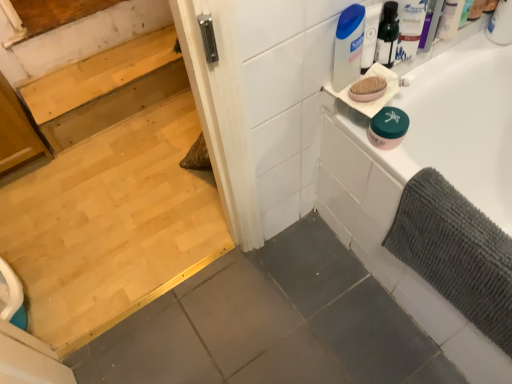
Question: From the image's perspective, does pink matte oval soap at upper right appear lower than green matte jar at upper right?

Choices:
 (A) yes
 (B) no

Answer: (B)

Question: Are pink matte oval soap at upper right and green matte jar at upper right making contact?

Choices:
 (A) no
 (B) yes

Answer: (B)

Question: Considering the relative sizes of pink matte oval soap at upper right and green matte jar at upper right in the image provided, is pink matte oval soap at upper right bigger than green matte jar at upper right?

Choices:
 (A) no
 (B) yes

Answer: (A)

Question: Are pink matte oval soap at upper right and green matte jar at upper right located far from each other?

Choices:
 (A) yes
 (B) no

Answer: (B)

Question: Is pink matte oval soap at upper right surrounding green matte jar at upper right?

Choices:
 (A) no
 (B) yes

Answer: (A)

Question: From the image's perspective, is light brown wood stairs at upper left located above or below white plastic container at upper right?

Choices:
 (A) above
 (B) below

Answer: (A)

Question: Looking at their shapes, would you say light brown wood stairs at upper left is wider or thinner than white plastic container at upper right?

Choices:
 (A) wide
 (B) thin

Answer: (A)

Question: From a real-world perspective, is light brown wood stairs at upper left positioned above or below white plastic container at upper right?

Choices:
 (A) above
 (B) below

Answer: (B)

Question: Would you say light brown wood stairs at upper left is to the left or to the right of white plastic container at upper right in the picture?

Choices:
 (A) right
 (B) left

Answer: (B)

Question: Considering the positions of gray textured bath mat at right and white plastic container at upper right in the image, is gray textured bath mat at right taller or shorter than white plastic container at upper right?

Choices:
 (A) short
 (B) tall

Answer: (B)

Question: Is gray textured bath mat at right inside or outside of white plastic container at upper right?

Choices:
 (A) outside
 (B) inside

Answer: (A)

Question: From the image's perspective, relative to white plastic container at upper right, is gray textured bath mat at right above or below?

Choices:
 (A) above
 (B) below

Answer: (B)

Question: In the image, is gray textured bath mat at right positioned in front of or behind white plastic container at upper right?

Choices:
 (A) behind
 (B) front

Answer: (B)

Question: Visually, is white plastic container at upper right positioned to the left or to the right of white plastic container at upper right?

Choices:
 (A) left
 (B) right

Answer: (A)

Question: In terms of width, does white plastic container at upper right look wider or thinner when compared to white plastic container at upper right?

Choices:
 (A) thin
 (B) wide

Answer: (A)